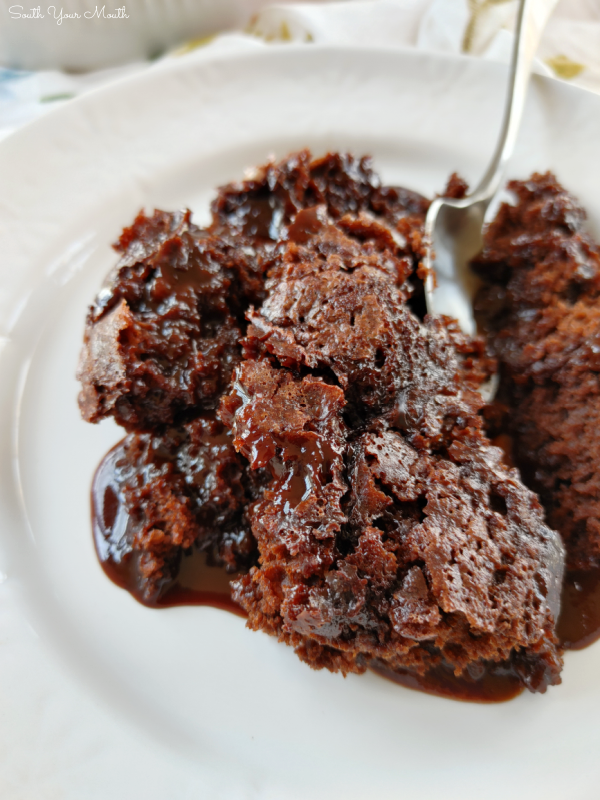
I want to click on rim of bowl, so click(346, 45).